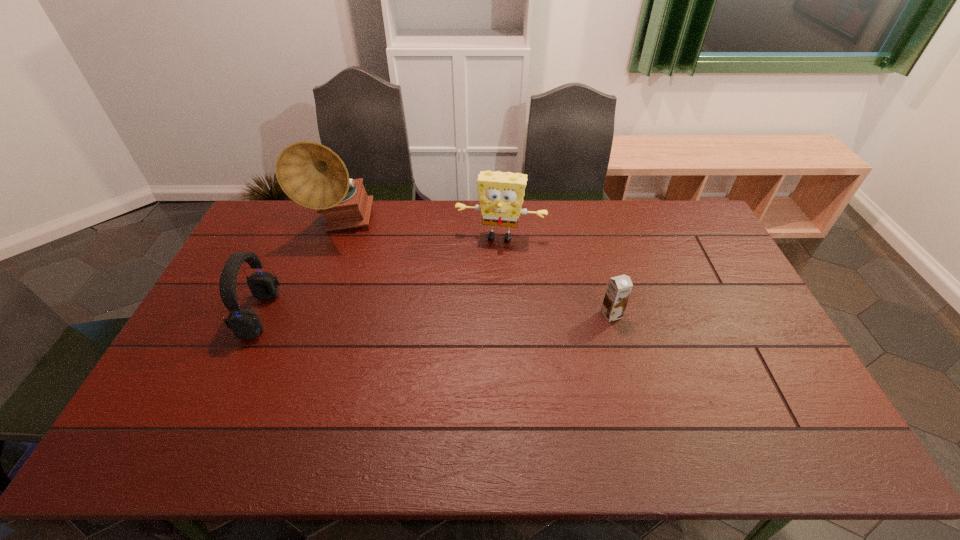
The width and height of the screenshot is (960, 540). In order to click on free space at the near left corner of the desktop in this screenshot , I will do `click(204, 403)`.

You are a GUI agent. You are given a task and a screenshot of the screen. Output one action in this format:
    pyautogui.click(x=<x>, y=<y>)
    Task: Click on the free space at the far right corner
    This screenshot has width=960, height=540.
    Given the screenshot: What is the action you would take?
    pyautogui.click(x=660, y=211)

Identify the location of free space that is in between the sponge and the tallest object. The height and width of the screenshot is (540, 960). [420, 231].

This screenshot has width=960, height=540. I want to click on vacant area that lies between the shortest object and the headset, so click(x=436, y=314).

Locate an element on the screen. This screenshot has height=540, width=960. free point between the chocolate milk and the headset is located at coordinates (436, 314).

In order to click on free spot between the sponge and the shortest object in this screenshot , I will do `click(556, 275)`.

Locate an element on the screen. free space between the shortest object and the headset is located at coordinates (436, 314).

In order to click on empty location between the second object from right to left and the shortest object in this screenshot , I will do `click(556, 275)`.

At what (x,y) coordinates should I click in order to perform the action: click on empty space that is in between the headset and the shortest object. Please return your answer as a coordinate pair (x, y). Looking at the image, I should click on (436, 314).

Where is `free space that is in between the headset and the tallest object`? This screenshot has width=960, height=540. free space that is in between the headset and the tallest object is located at coordinates (300, 269).